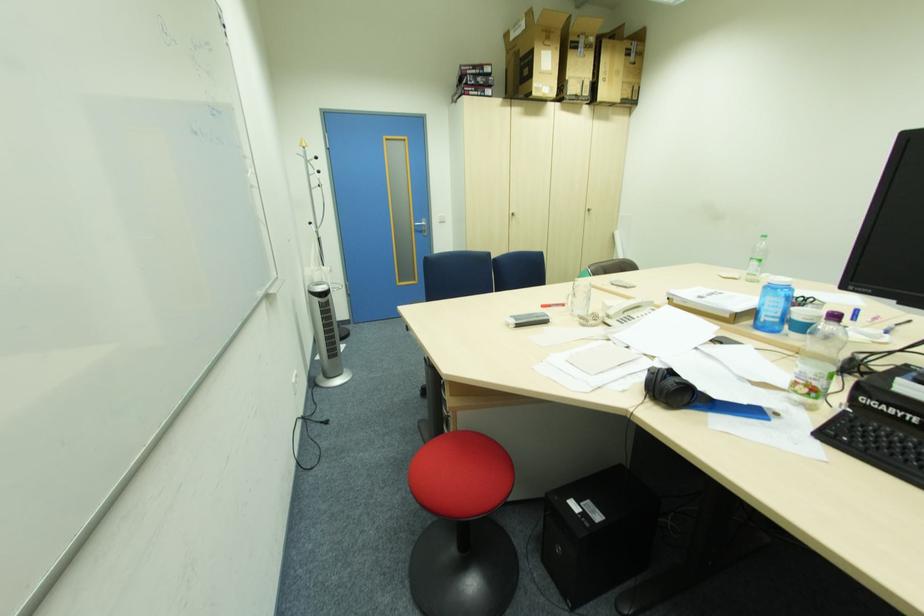
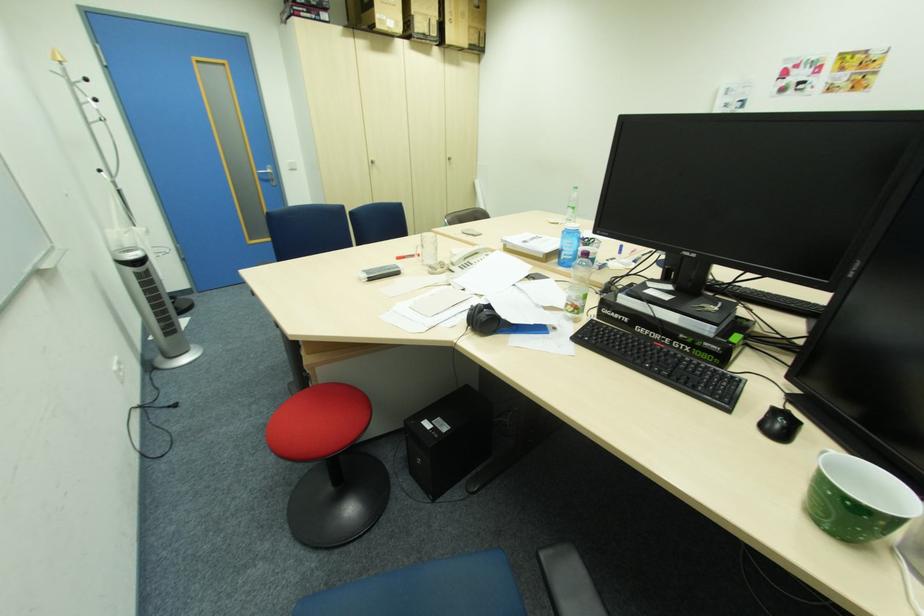
Locate, in the second image, the point that corresponds to (x=591, y=92) in the first image.

(441, 31)